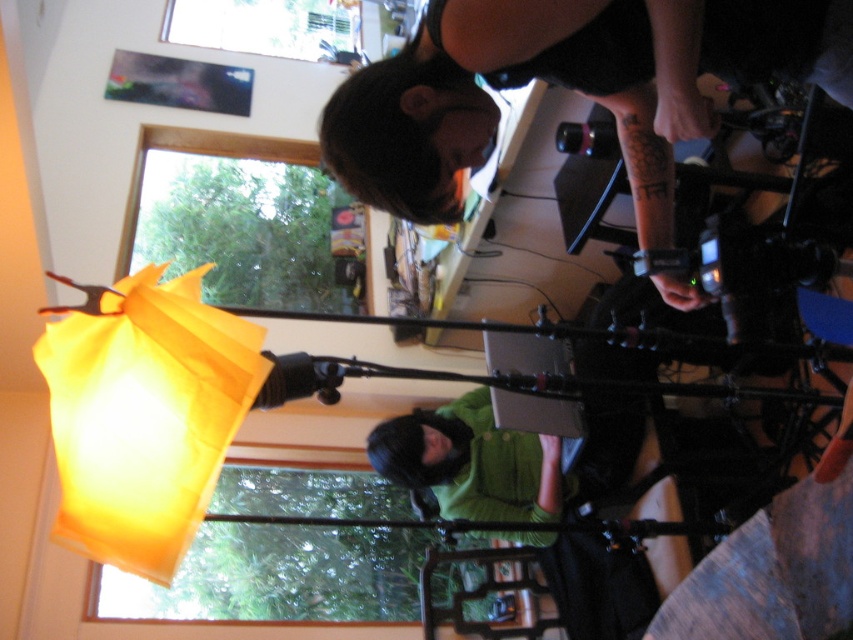
Can you confirm if black matte shirt at upper center is thinner than yellow translucent paper lantern at left?

No.

Does black matte shirt at upper center come behind yellow translucent paper lantern at left?

That is False.

Based on the photo, who is more forward, (485, 52) or (160, 445)?

Positioned in front is point (160, 445).

Identify the location of black matte shirt at upper center. (567, 88).

Which is more to the right, black matte shirt at upper center or green matte shirt at lower center?

black matte shirt at upper center is more to the right.

Is black matte shirt at upper center wider than green matte shirt at lower center?

Yes, black matte shirt at upper center is wider than green matte shirt at lower center.

Does point (378, 157) come in front of point (544, 483)?

Yes.

You are a GUI agent. You are given a task and a screenshot of the screen. Output one action in this format:
    pyautogui.click(x=<x>, y=<y>)
    Task: Click on the black matte shirt at upper center
    Image resolution: width=853 pixels, height=640 pixels.
    Given the screenshot: What is the action you would take?
    pyautogui.click(x=567, y=88)

Does yellow translucent paper lantern at left appear on the right side of green matte shirt at lower center?

In fact, yellow translucent paper lantern at left is to the left of green matte shirt at lower center.

Can you confirm if yellow translucent paper lantern at left is bigger than green matte shirt at lower center?

Actually, yellow translucent paper lantern at left might be smaller than green matte shirt at lower center.

Is point (154, 458) positioned after point (560, 509)?

No, it is in front of (560, 509).

The image size is (853, 640). Identify the location of yellow translucent paper lantern at left. (143, 413).